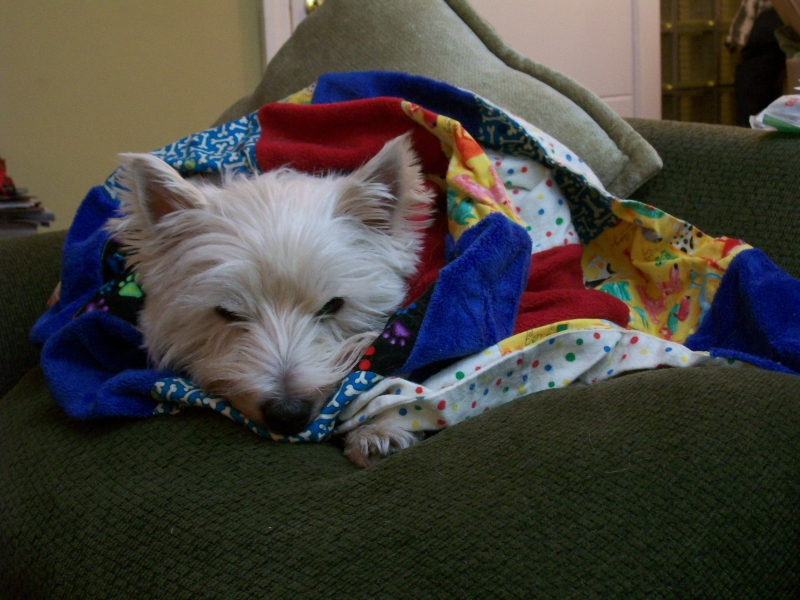
The image size is (800, 600). Find the location of `pillow`. pillow is located at coordinates (448, 48).